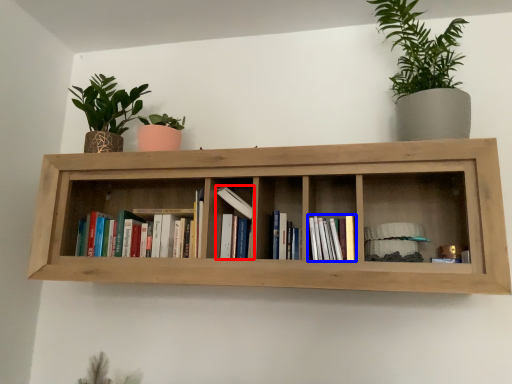
Question: Which object appears farthest to the camera in this image, book (highlighted by a red box) or book (highlighted by a blue box)?

Choices:
 (A) book
 (B) book

Answer: (A)